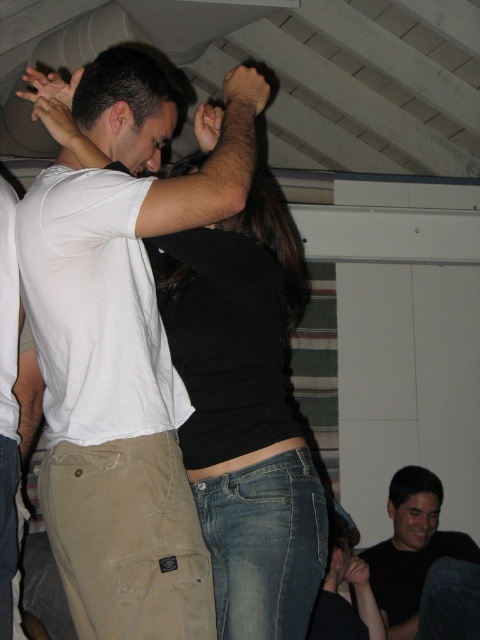
Does black matte shirt at center appear on the right side of white matte t-shirt at center?

Indeed, black matte shirt at center is positioned on the right side of white matte t-shirt at center.

Can you confirm if black matte shirt at center is wider than white matte t-shirt at center?

Yes.

Does point (240, 614) lie in front of point (60, 332)?

That is True.

Locate an element on the screen. black matte shirt at center is located at coordinates (244, 413).

Does white cotton t-shirt at center have a lesser height compared to black matte shirt at center?

Incorrect, white cotton t-shirt at center's height does not fall short of black matte shirt at center's.

Does point (73, 561) lie in front of point (237, 218)?

Yes, it is in front of point (237, 218).

The height and width of the screenshot is (640, 480). In order to click on white cotton t-shirt at center in this screenshot , I will do `click(122, 380)`.

Locate an element on the screen. white cotton t-shirt at center is located at coordinates (122, 380).

Can you confirm if white cotton t-shirt at center is thinner than white matte t-shirt at center?

Incorrect, white cotton t-shirt at center's width is not less than white matte t-shirt at center's.

Does point (34, 304) lie behind point (119, 380)?

That is True.

Identify the location of white cotton t-shirt at center. click(x=122, y=380).